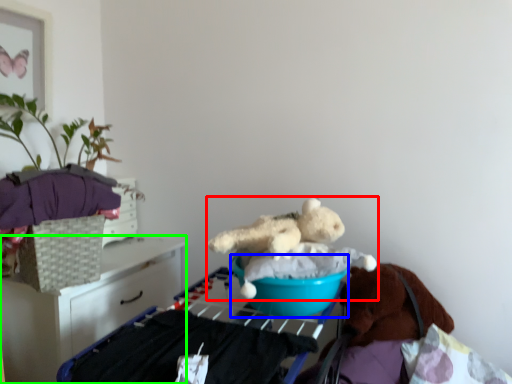
Question: Which is nearer to the teddy bear (highlighted by a red box)? basin (highlighted by a blue box) or furniture (highlighted by a green box).

Choices:
 (A) basin
 (B) furniture

Answer: (A)